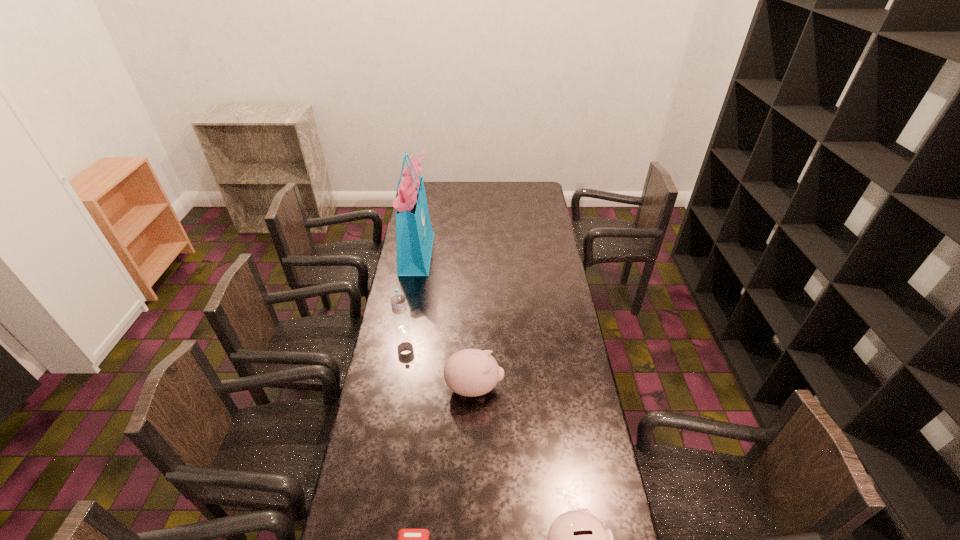
You are a GUI agent. You are given a task and a screenshot of the screen. Output one action in this format:
    pyautogui.click(x=<x>, y=<y>)
    Task: Click on the farthest object
    
    Given the screenshot: What is the action you would take?
    pyautogui.click(x=414, y=235)

Find the location of a particular element. The image size is (960, 540). shopping bag is located at coordinates (414, 235).

Where is `water bottle`? water bottle is located at coordinates (398, 299).

At what (x,y) coordinates should I click in order to perform the action: click on the second farthest object. Please return your answer as a coordinate pair (x, y). This screenshot has width=960, height=540. Looking at the image, I should click on pyautogui.click(x=398, y=299).

This screenshot has width=960, height=540. What are the coordinates of `the left piggy bank` in the screenshot? It's located at (470, 372).

The image size is (960, 540). What are the coordinates of `the farther piggy bank` in the screenshot? It's located at (470, 372).

The width and height of the screenshot is (960, 540). Find the location of `blank space located on the right of the farthest object`. blank space located on the right of the farthest object is located at coordinates (470, 252).

Where is `vacant area situated 0.270m on the back of the water bottle`? vacant area situated 0.270m on the back of the water bottle is located at coordinates (412, 281).

You are a GUI agent. You are given a task and a screenshot of the screen. Output one action in this format:
    pyautogui.click(x=<x>, y=<y>)
    Task: Click on the vacant region located 0.060m at the snout of the farther piggy bank
    This screenshot has width=960, height=540.
    Given the screenshot: What is the action you would take?
    pyautogui.click(x=520, y=388)

This screenshot has height=540, width=960. I want to click on shopping bag situated at the left edge, so click(414, 235).